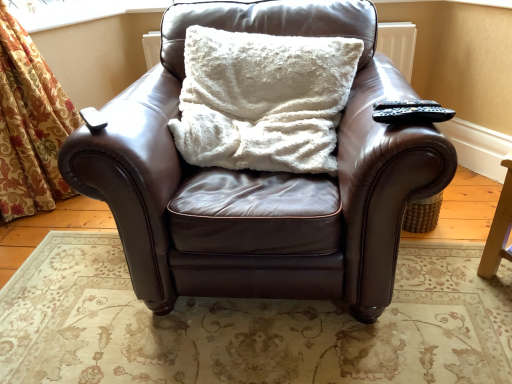
Question: Based on their positions, is transparent plastic window screen at upper left located to the left or right of black plastic remote at upper right?

Choices:
 (A) left
 (B) right

Answer: (A)

Question: Is transparent plastic window screen at upper left in front of or behind black plastic remote at upper right in the image?

Choices:
 (A) behind
 (B) front

Answer: (A)

Question: Which of these objects is positioned farthest from the black plastic remote at upper right?

Choices:
 (A) white fluffy pillow at center
 (B) brown leather chair at center
 (C) transparent plastic window screen at upper left

Answer: (C)

Question: Which is nearer to the brown leather chair at center?

Choices:
 (A) black plastic remote at upper right
 (B) transparent plastic window screen at upper left
 (C) white fluffy pillow at center

Answer: (C)